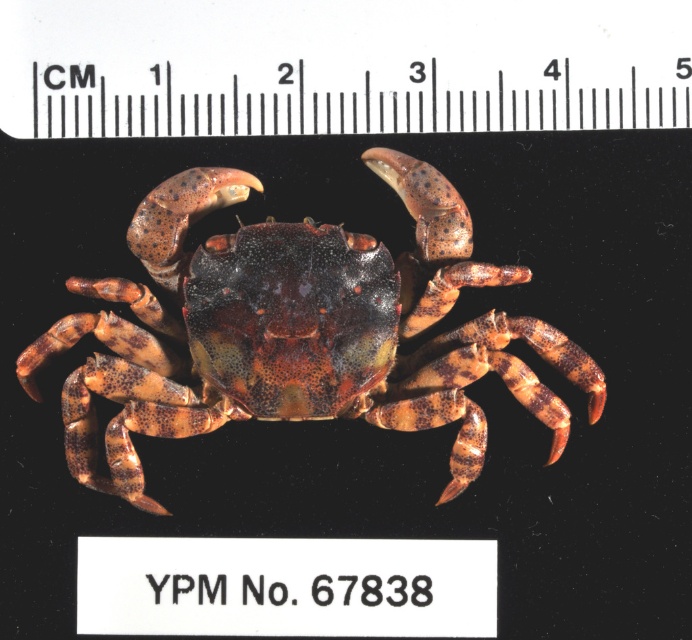
Question: Is speckled brown crab at center bigger than black plastic ruler at upper center?

Choices:
 (A) yes
 (B) no

Answer: (A)

Question: Where is speckled brown crab at center located in relation to black plastic ruler at upper center in the image?

Choices:
 (A) below
 (B) above

Answer: (A)

Question: Which point is farther to the camera?

Choices:
 (A) (406, 88)
 (B) (268, 237)

Answer: (A)

Question: Does speckled brown crab at center have a greater width compared to black plastic ruler at upper center?

Choices:
 (A) yes
 (B) no

Answer: (B)

Question: Among these points, which one is nearest to the camera?

Choices:
 (A) (200, 22)
 (B) (203, 349)

Answer: (B)